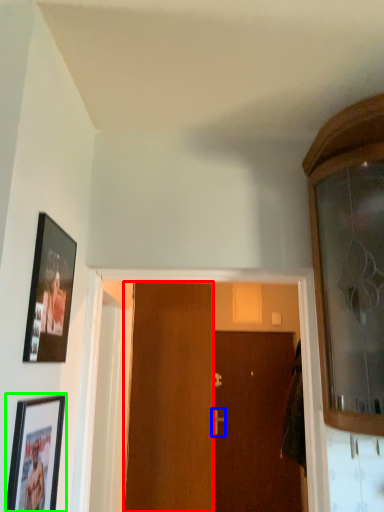
Question: Which is farther away from door (highlighted by a red box)? door handle (highlighted by a blue box) or picture frame (highlighted by a green box)?

Choices:
 (A) door handle
 (B) picture frame

Answer: (A)